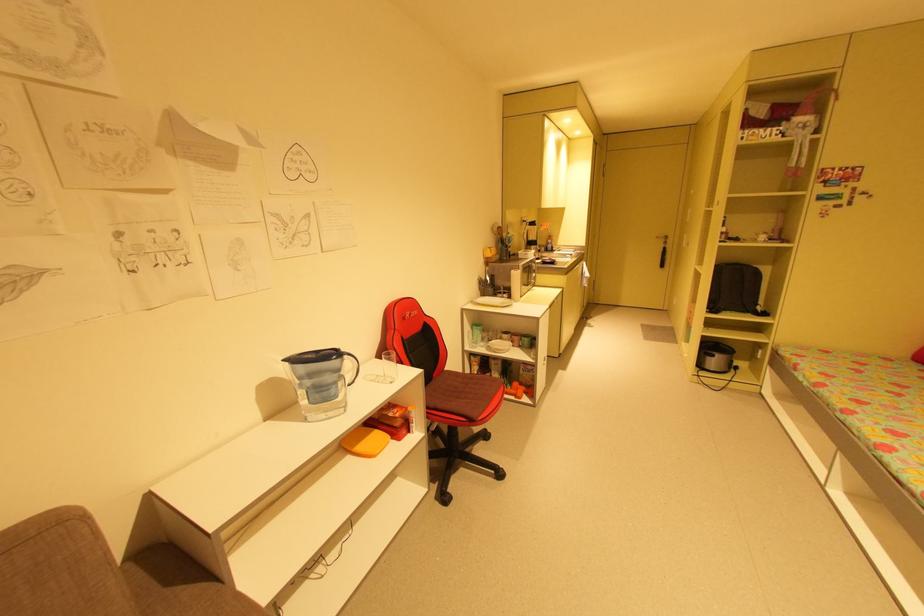
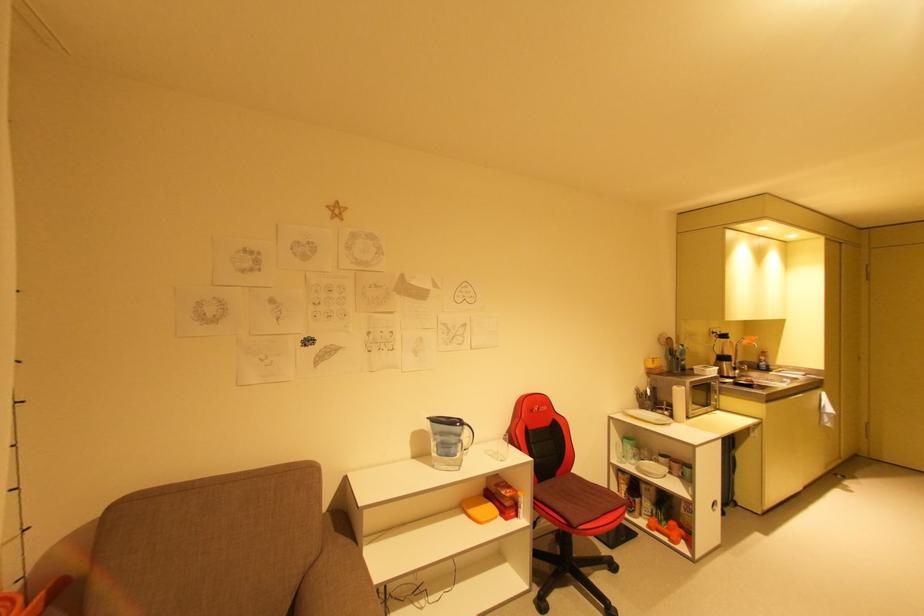
Find the pixel in the second image that matches (362,448) in the first image.

(477, 512)